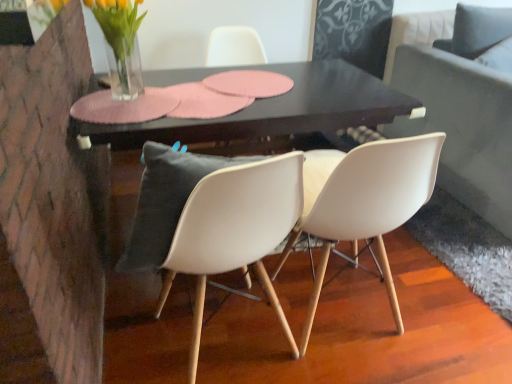
I want to click on free space below white plastic chair at center, the 3th chair viewed from the back (from a real-world perspective), so click(237, 341).